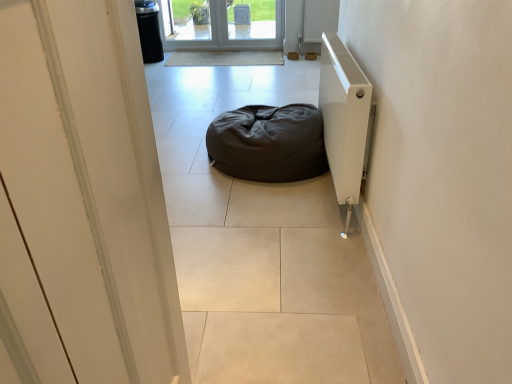
Image resolution: width=512 pixels, height=384 pixels. I want to click on empty space that is in between dark fabric bean bag at center and white textured radiator at right, so click(281, 199).